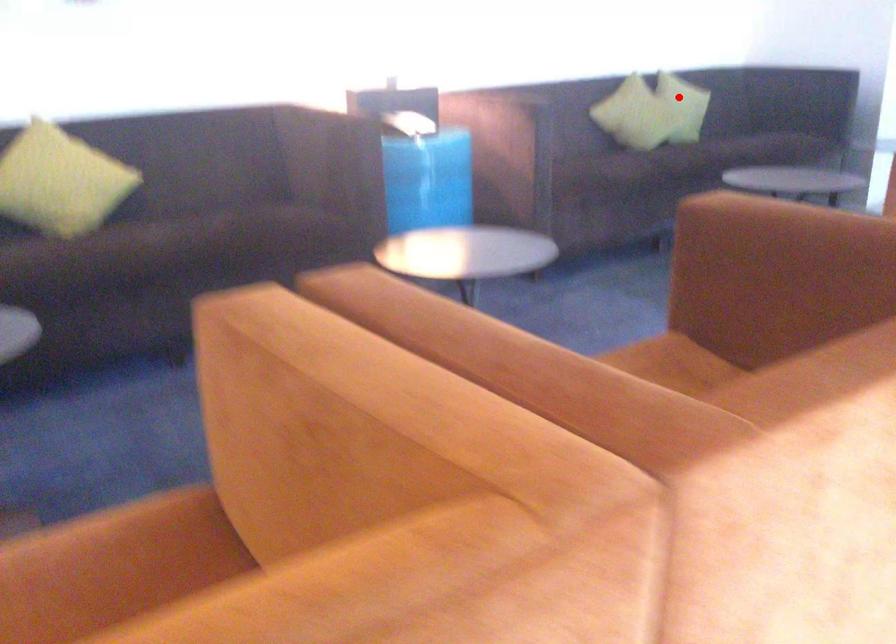
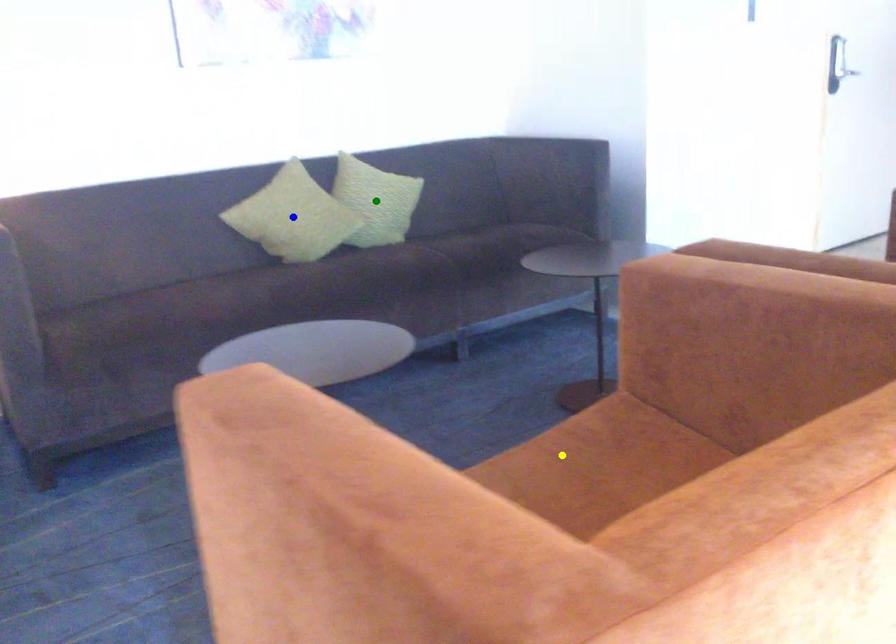
Question: I am providing you with two images of the same scene from different viewpoints. A red point is marked on the first image. You are given multiple points on the second image. Which spot in image 2 lines up with the point in image 1?

Choices:
 (A) green point
 (B) blue point
 (C) yellow point

Answer: (B)